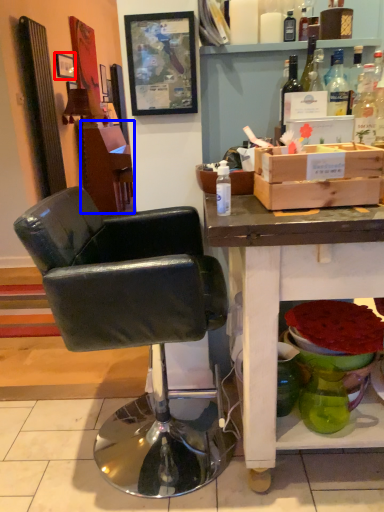
Question: Which point is further to the camera, picture frame (highlighted by a red box) or vanity (highlighted by a blue box)?

Choices:
 (A) picture frame
 (B) vanity

Answer: (B)